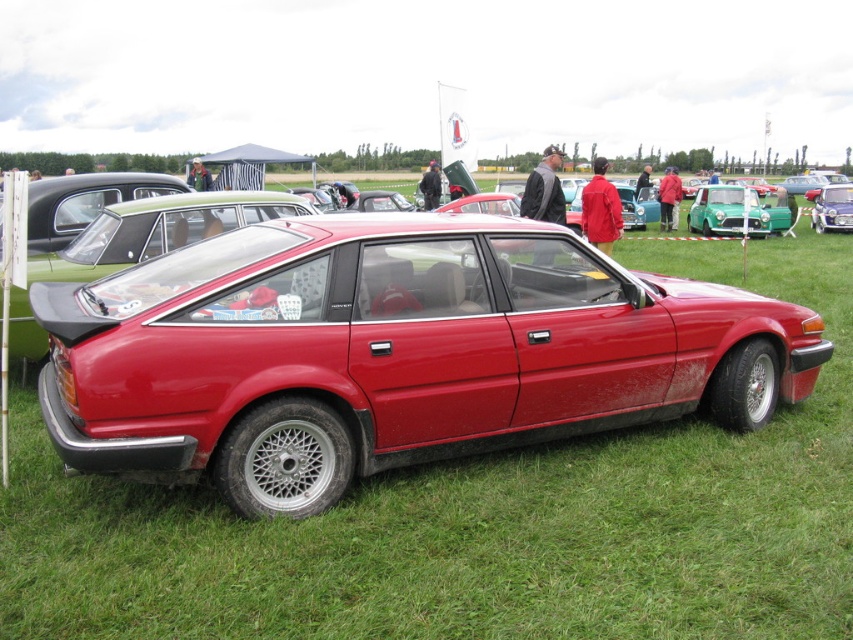
You are standing at the point closest to the vintage red sports car. Which of the two points, point (287, 292) or point (842, 218), is closer to you?

Point (287, 292) is in front of point (842, 218), so it is closer to you.

You are standing at the point closest to the camera in the image, which is point (x=47, y=330). You want to walk towards the point (x=701, y=214). Is there any obstacle between you and your destination?

The point (x=47, y=330) is closer to the camera than the point (x=701, y=214), so you are standing closer to the camera. However, the scene description mentions a vintage red sports car parked on a grassy field with other vehicles like a green Mini Cooper and a black vintage car in the background. These vehicles could potentially block your path between the two points. Therefore, there might be obstacles between you and the destination point (x=701, y=214).